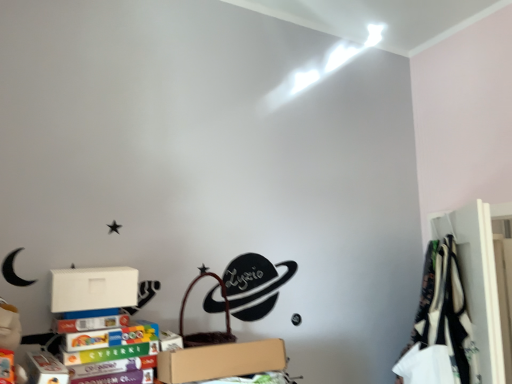
Question: Is white fabric at right shorter than white matte cardboard box at lower left?

Choices:
 (A) no
 (B) yes

Answer: (A)

Question: From a real-world perspective, is white fabric at right physically below white matte cardboard box at lower left?

Choices:
 (A) yes
 (B) no

Answer: (A)

Question: Is white fabric at right positioned beyond the bounds of white matte cardboard box at lower left?

Choices:
 (A) yes
 (B) no

Answer: (A)

Question: Is white fabric at right facing away from white matte cardboard box at lower left?

Choices:
 (A) yes
 (B) no

Answer: (B)

Question: From the image's perspective, is white fabric at right on white matte cardboard box at lower left?

Choices:
 (A) no
 (B) yes

Answer: (A)

Question: Is white fabric at right behind white matte cardboard box at lower left?

Choices:
 (A) no
 (B) yes

Answer: (B)

Question: Is brown cardboard box at lower center taller than white matte cardboard box at lower left?

Choices:
 (A) yes
 (B) no

Answer: (A)

Question: Is brown cardboard box at lower center to the right of white matte cardboard box at lower left from the viewer's perspective?

Choices:
 (A) no
 (B) yes

Answer: (B)

Question: Could you tell me if brown cardboard box at lower center is facing white matte cardboard box at lower left?

Choices:
 (A) no
 (B) yes

Answer: (A)

Question: Does brown cardboard box at lower center have a greater width compared to white matte cardboard box at lower left?

Choices:
 (A) no
 (B) yes

Answer: (B)

Question: From a real-world perspective, is brown cardboard box at lower center over white matte cardboard box at lower left?

Choices:
 (A) yes
 (B) no

Answer: (B)

Question: Is brown cardboard box at lower center shorter than white matte cardboard box at lower left?

Choices:
 (A) no
 (B) yes

Answer: (A)

Question: Could you tell me if white fabric at right is turned towards brown cardboard box at lower center?

Choices:
 (A) no
 (B) yes

Answer: (B)